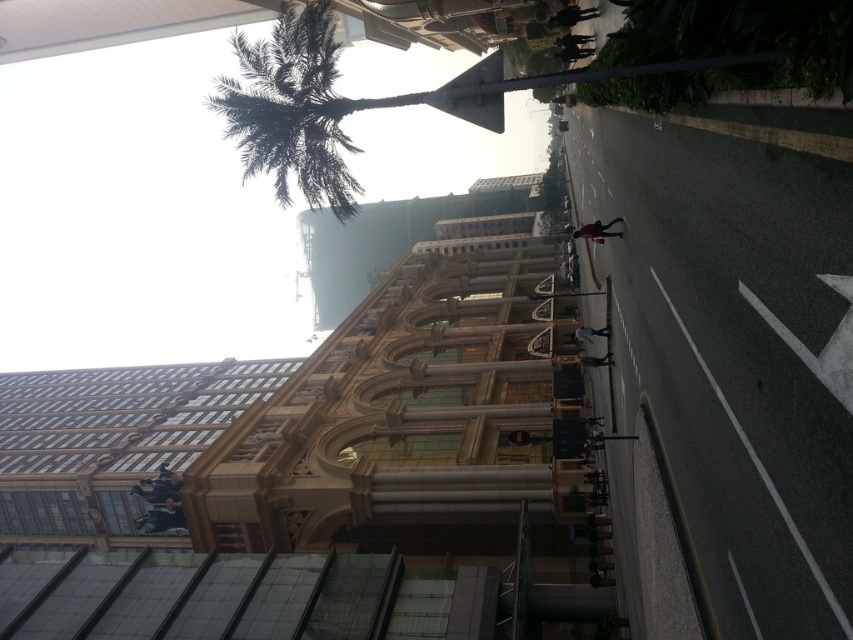
Question: Which point is closer to the camera?

Choices:
 (A) (601, 438)
 (B) (322, 141)

Answer: (B)

Question: Which point is closer to the camera taking this photo?

Choices:
 (A) (322, 61)
 (B) (616, 436)

Answer: (A)

Question: Observing the image, what is the correct spatial positioning of green leafy palm tree at upper left in reference to metallic pole at center?

Choices:
 (A) right
 (B) left

Answer: (B)

Question: Is green leafy palm tree at upper left above metallic pole at center?

Choices:
 (A) yes
 (B) no

Answer: (A)

Question: In this image, where is green leafy palm tree at upper left located relative to metallic pole at center?

Choices:
 (A) below
 (B) above

Answer: (B)